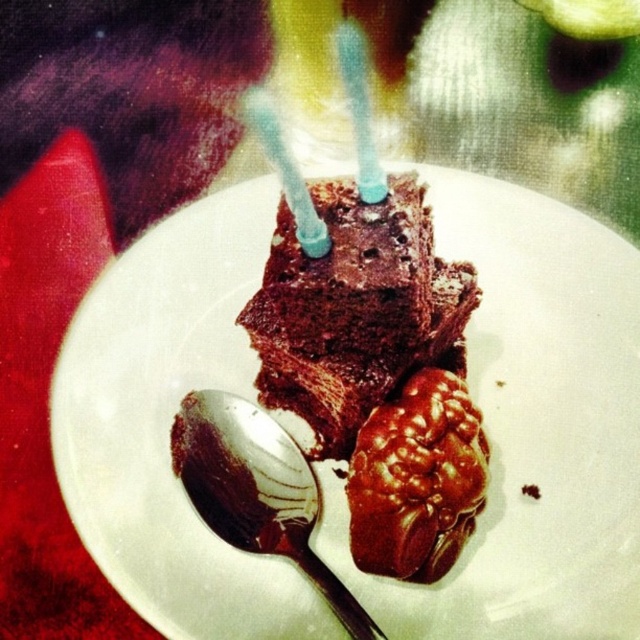
You are a person with an average arm length of 28 inches. You are holding a silver spoon and want to pick up the shiny chocolate candy at center. Can you reach it without moving your arm?

The shiny chocolate candy at center and viewer are 35.82 inches apart from each other. Since your arm length is only 28 inches, you cannot reach the shiny chocolate candy at center without moving your arm.

You are at a birthday party and want to grab the shiny chocolate candy at center and the shiny silver spoon at lower left. If you reach for them from above, which one will your hand touch first?

A: The shiny chocolate candy at center is above the shiny silver spoon at lower left, so your hand will touch the shiny chocolate candy at center first when reaching from above.